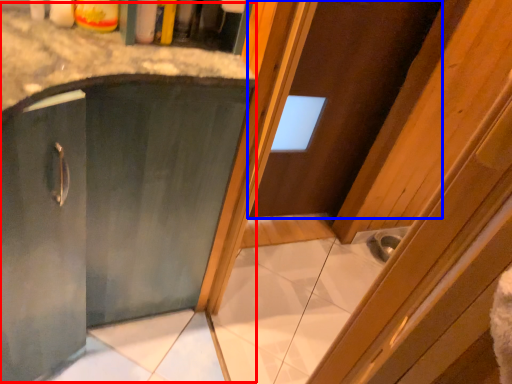
Question: Which of the following is the farthest to the observer, cabinetry (highlighted by a red box) or door (highlighted by a blue box)?

Choices:
 (A) cabinetry
 (B) door

Answer: (B)